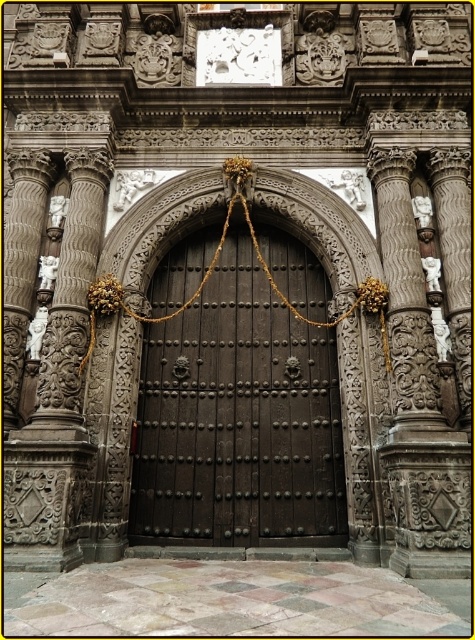
Question: Does dark wood door at center have a larger size compared to gold rope at center?

Choices:
 (A) yes
 (B) no

Answer: (A)

Question: Which object is closer to the camera taking this photo?

Choices:
 (A) dark wood door at center
 (B) gold rope at center

Answer: (A)

Question: Is dark wood door at center further to camera compared to gold rope at center?

Choices:
 (A) yes
 (B) no

Answer: (B)

Question: Is dark wood door at center positioned at the back of gold rope at center?

Choices:
 (A) yes
 (B) no

Answer: (B)

Question: Which of the following is the closest to the observer?

Choices:
 (A) dark wood door at center
 (B) gold rope at center

Answer: (A)